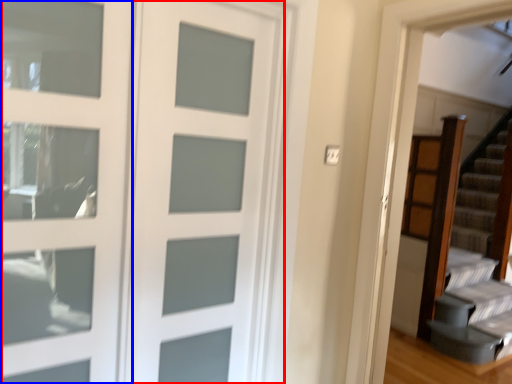
Question: Which object is further to the camera taking this photo, door (highlighted by a red box) or screen door (highlighted by a blue box)?

Choices:
 (A) door
 (B) screen door

Answer: (A)